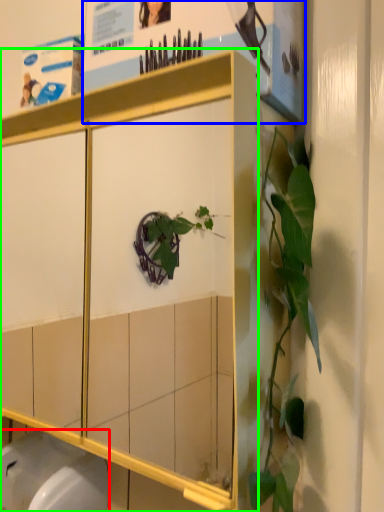
Question: Which object is positioned closest to toilet bowl (highlighted by a red box)? Select from poster page (highlighted by a blue box) and cabinetry (highlighted by a green box).

Choices:
 (A) poster page
 (B) cabinetry

Answer: (B)